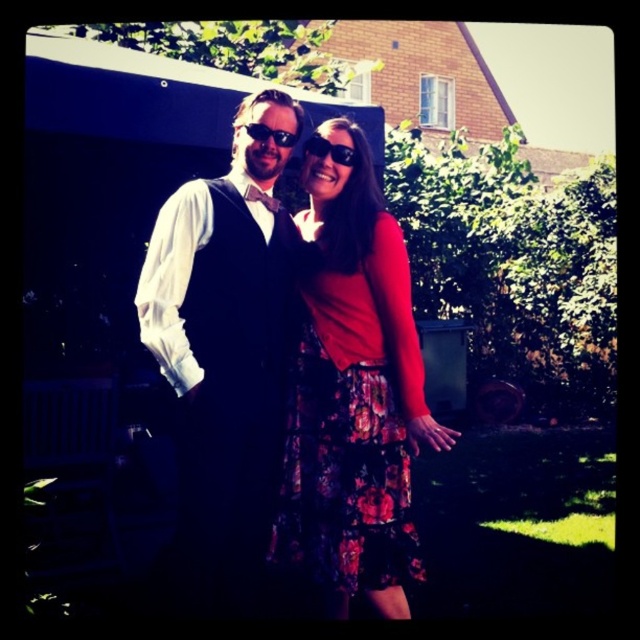
You are a photographer trying to capture a closeup of the floral skirt at center. Based on the coordinates provided in the scene description, can you determine if the skirt is positioned centrally within the frame?

The floral skirt at center is located at point [353,396], which means it is slightly off the center of the frame since the exact center would be at [320,320]. Therefore, the skirt is positioned to the right and slightly above the central point.

What is the exact coordinate of the matte black vest at center?

The matte black vest at center is located at point (225, 349).

You are a tailor trying to fit a customer for a new vest. You observe the matte black vest at center and the black plastic sunglasses at center in the image. Which item has a greater width?

The matte black vest at center has a greater width than the black plastic sunglasses at center.